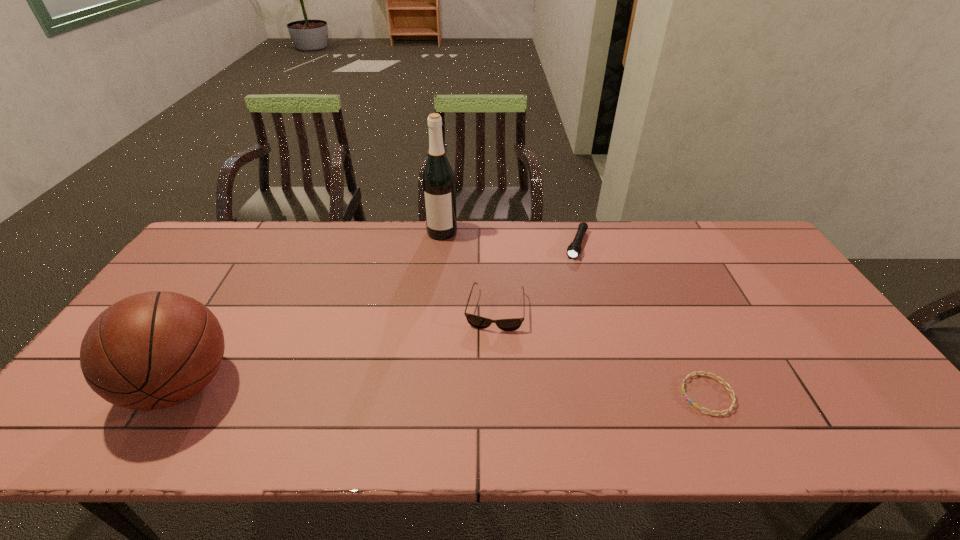
This screenshot has height=540, width=960. What are the coordinates of `the leftmost object` in the screenshot? It's located at (153, 350).

Image resolution: width=960 pixels, height=540 pixels. What are the coordinates of `basketball` in the screenshot? It's located at click(x=153, y=350).

At what (x,y) coordinates should I click in order to perform the action: click on the rightmost object. Please return your answer as a coordinate pair (x, y). Looking at the image, I should click on (731, 391).

Locate an element on the screen. bracelet is located at coordinates (731, 391).

I want to click on wine bottle, so click(438, 181).

This screenshot has height=540, width=960. I want to click on the second object from left to right, so [x=438, y=181].

Where is `flashlight`? This screenshot has width=960, height=540. flashlight is located at coordinates (574, 249).

I want to click on the third farthest object, so click(479, 322).

Find the location of a particular element. This screenshot has width=960, height=540. sunglasses is located at coordinates (479, 322).

Locate an element on the screen. free space located on the back of the leftmost object is located at coordinates (240, 289).